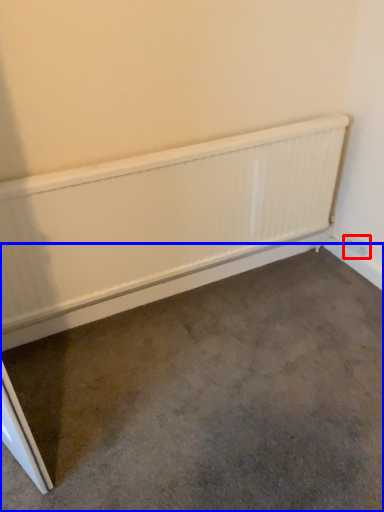
Question: Which of the following is the closest to the observer, electric outlet (highlighted by a red box) or concrete (highlighted by a blue box)?

Choices:
 (A) electric outlet
 (B) concrete

Answer: (B)